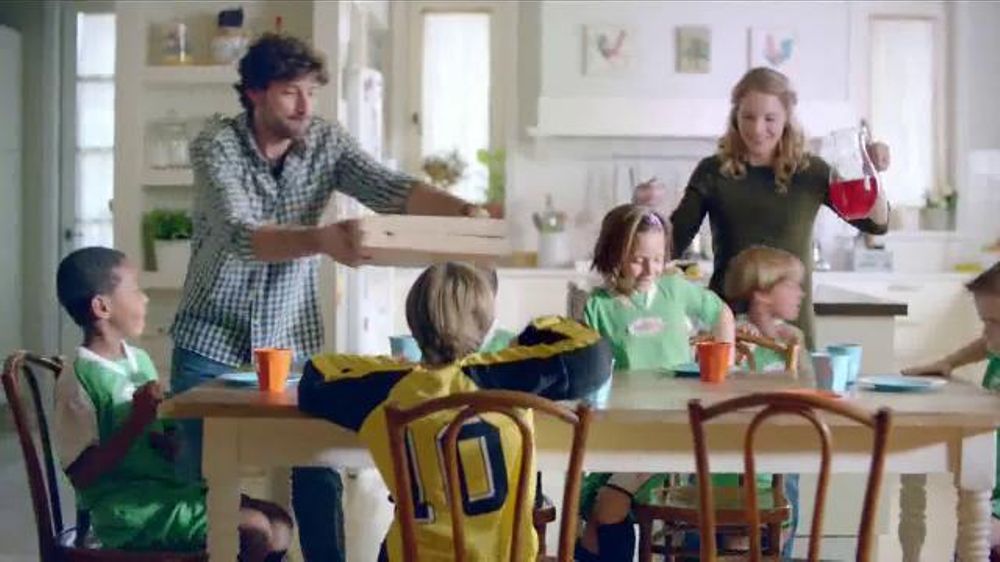
You are a GUI agent. You are given a task and a screenshot of the screen. Output one action in this format:
    pyautogui.click(x=<x>, y=<y>)
    Task: Click on the blue cups
    The image size is (1000, 562).
    Given the screenshot: What is the action you would take?
    pyautogui.click(x=860, y=348), pyautogui.click(x=834, y=373)